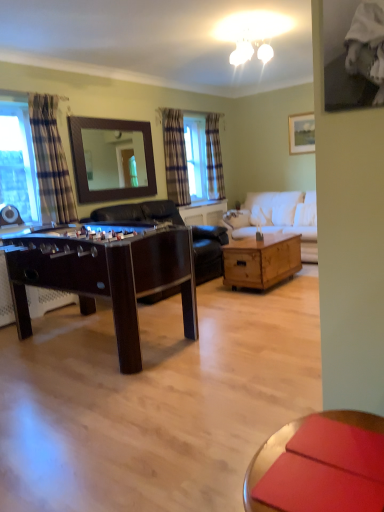
Locate an element on the screen. vacant region above wooden framed mirror at upper center (from a real-world perspective) is located at coordinates (100, 119).